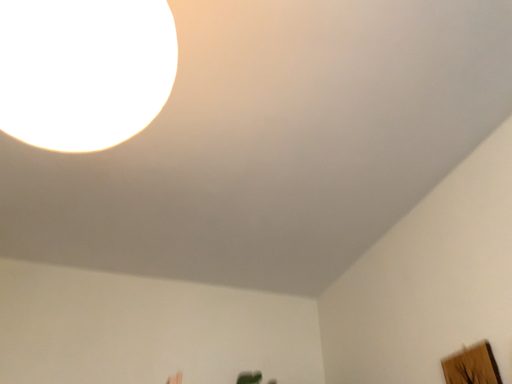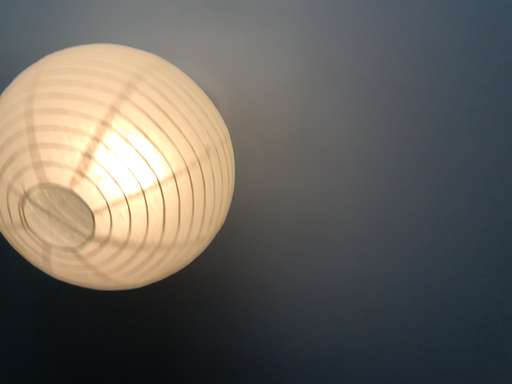
Question: How did the camera likely rotate when shooting the video?

Choices:
 (A) rotated upward
 (B) rotated downward

Answer: (A)